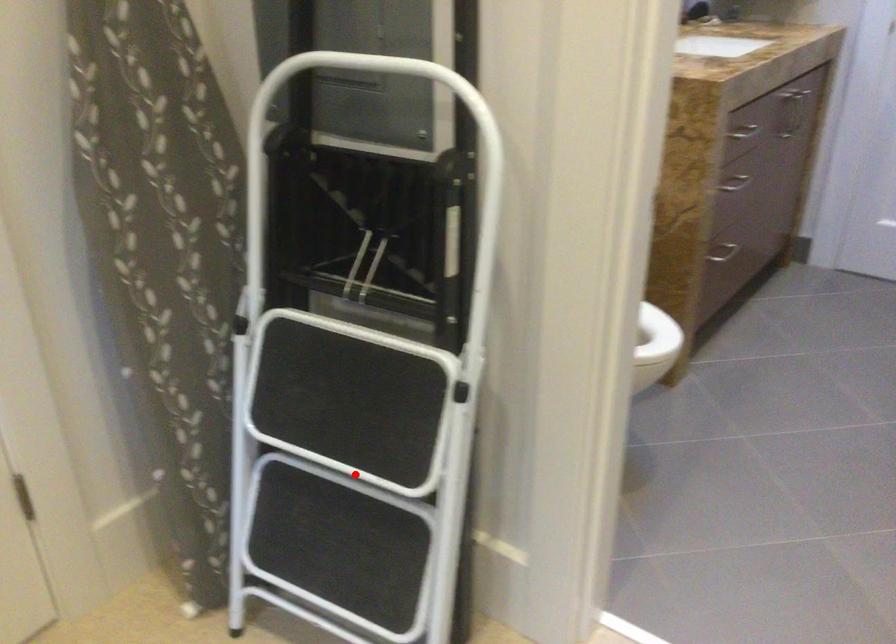
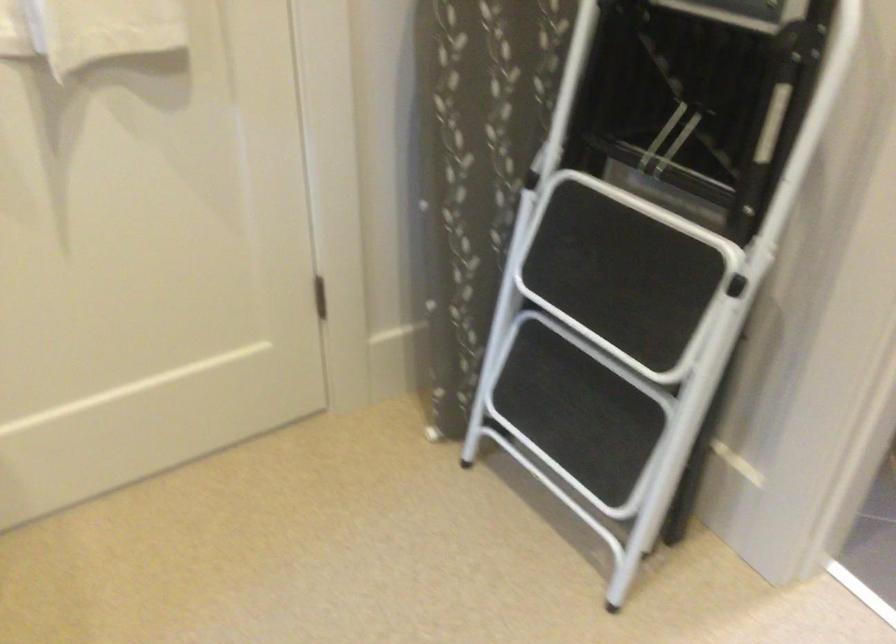
In the second image, find the point that corresponds to the highlighted location in the first image.

(607, 342)